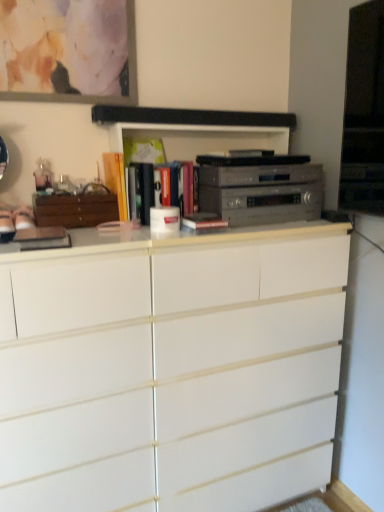
I want to click on free space on the front side of hardcover book at center, which is the third book from left to right, so click(129, 234).